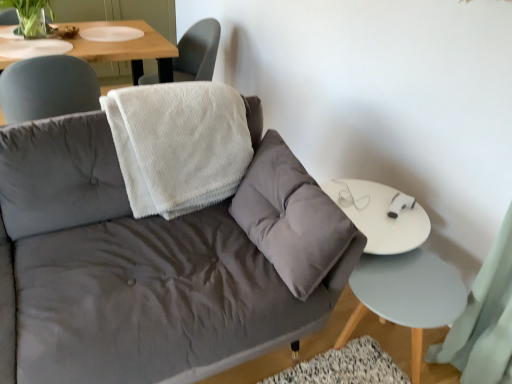
Question: Is light blue wood side table at lower right to the left or to the right of white fluffy blanket at upper center in the image?

Choices:
 (A) right
 (B) left

Answer: (A)

Question: Considering their positions, is light blue wood side table at lower right located in front of or behind white fluffy blanket at upper center?

Choices:
 (A) front
 (B) behind

Answer: (A)

Question: Which of these objects is positioned farthest from the light blue wood side table at lower right?

Choices:
 (A) green matte plant at upper left
 (B) white textured towel at upper center
 (C) velvet gray couch at center
 (D) white fluffy blanket at upper center

Answer: (A)

Question: Which is nearer to the white textured towel at upper center?

Choices:
 (A) velvet gray couch at center
 (B) white fluffy blanket at upper center
 (C) green matte plant at upper left
 (D) light blue wood side table at lower right

Answer: (C)